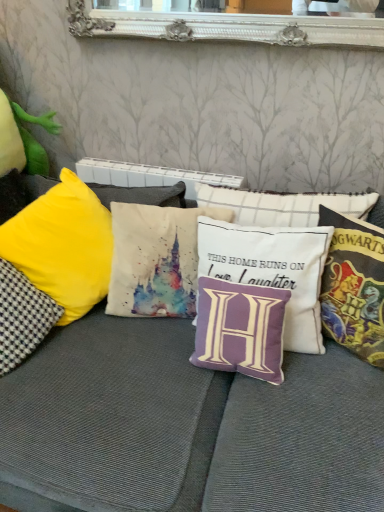
Question: Which direction should I rotate to face watercolor fabric castle at center, which is the 2th pillow in left-to-right order, — up or down?

Choices:
 (A) down
 (B) up

Answer: (B)

Question: Should I look upward or downward to see yellow fabric pillow at left, the 1th pillow viewed from the left?

Choices:
 (A) down
 (B) up

Answer: (A)

Question: From the image's perspective, is yellow fabric pillow at left, the 5th pillow from the right, located beneath purple fabric pillow at center, which is the 2th pillow from right to left?

Choices:
 (A) yes
 (B) no

Answer: (A)

Question: Is yellow fabric pillow at left, the 5th pillow from the right, to the left of purple fabric pillow at center, the 4th pillow positioned from the left, from the viewer's perspective?

Choices:
 (A) yes
 (B) no

Answer: (A)

Question: Is yellow fabric pillow at left, the 5th pillow from the right, facing towards purple fabric pillow at center, which is the 2th pillow from right to left?

Choices:
 (A) no
 (B) yes

Answer: (A)

Question: Can you confirm if yellow fabric pillow at left, the 1th pillow viewed from the left, is smaller than purple fabric pillow at center, which is the 2th pillow from right to left?

Choices:
 (A) no
 (B) yes

Answer: (B)

Question: From the image's perspective, is yellow fabric pillow at left, the 1th pillow viewed from the left, located above purple fabric pillow at center, the 4th pillow positioned from the left?

Choices:
 (A) no
 (B) yes

Answer: (A)

Question: Is yellow fabric pillow at left, the 5th pillow from the right, surrounding purple fabric pillow at center, the 4th pillow positioned from the left?

Choices:
 (A) yes
 (B) no

Answer: (B)

Question: Does watercolor fabric castle at center, which is the 2th pillow in left-to-right order, have a greater height compared to yellow fabric pillow at left, the 1th pillow viewed from the left?

Choices:
 (A) yes
 (B) no

Answer: (A)

Question: Can you confirm if watercolor fabric castle at center, the 4th pillow in the right-to-left sequence, is positioned to the right of yellow fabric pillow at left, the 5th pillow from the right?

Choices:
 (A) no
 (B) yes

Answer: (B)

Question: Is watercolor fabric castle at center, the 4th pillow in the right-to-left sequence, oriented towards yellow fabric pillow at left, the 5th pillow from the right?

Choices:
 (A) no
 (B) yes

Answer: (A)

Question: Considering the relative sizes of watercolor fabric castle at center, which is the 2th pillow in left-to-right order, and yellow fabric pillow at left, the 5th pillow from the right, in the image provided, is watercolor fabric castle at center, which is the 2th pillow in left-to-right order, thinner than yellow fabric pillow at left, the 5th pillow from the right,?

Choices:
 (A) no
 (B) yes

Answer: (B)

Question: Can you see watercolor fabric castle at center, which is the 2th pillow in left-to-right order, touching yellow fabric pillow at left, the 5th pillow from the right?

Choices:
 (A) yes
 (B) no

Answer: (B)

Question: Does watercolor fabric castle at center, which is the 2th pillow in left-to-right order, have a smaller size compared to yellow fabric pillow at left, the 1th pillow viewed from the left?

Choices:
 (A) yes
 (B) no

Answer: (B)

Question: Is watercolor fabric castle at center, which is the 2th pillow in left-to-right order, aimed at multicolored fabric hogwarts-themed pillow at right, the first pillow from the right?

Choices:
 (A) yes
 (B) no

Answer: (B)